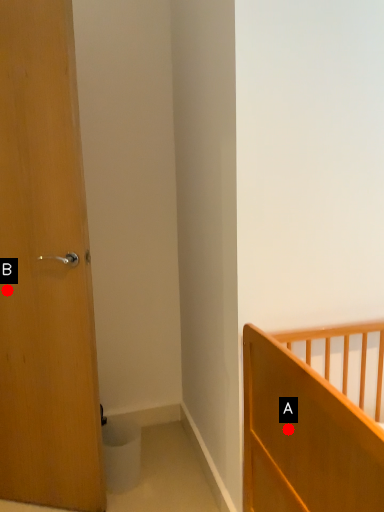
Question: Two points are circled on the image, labeled by A and B beside each circle. Among these points, which one is nearest to the camera?

Choices:
 (A) A is closer
 (B) B is closer

Answer: (A)